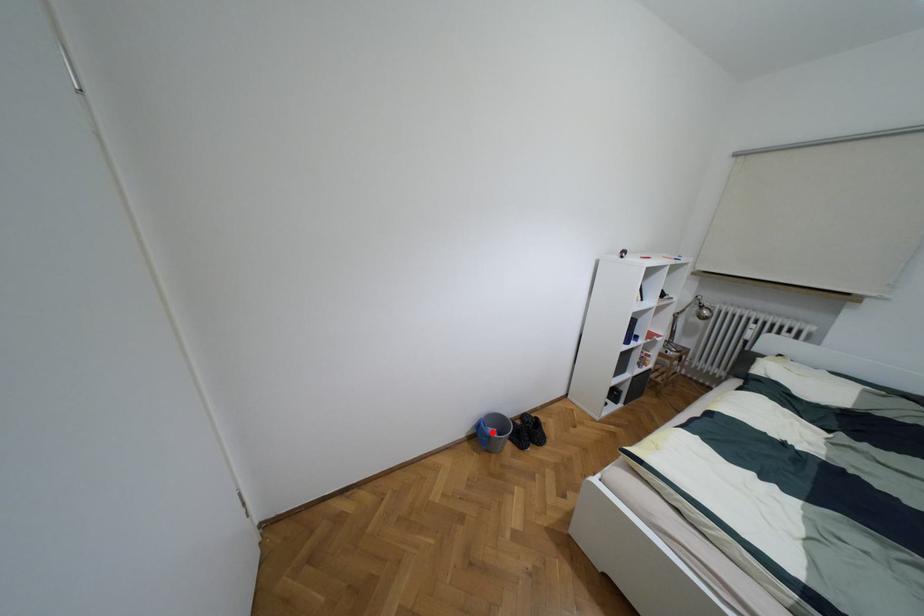
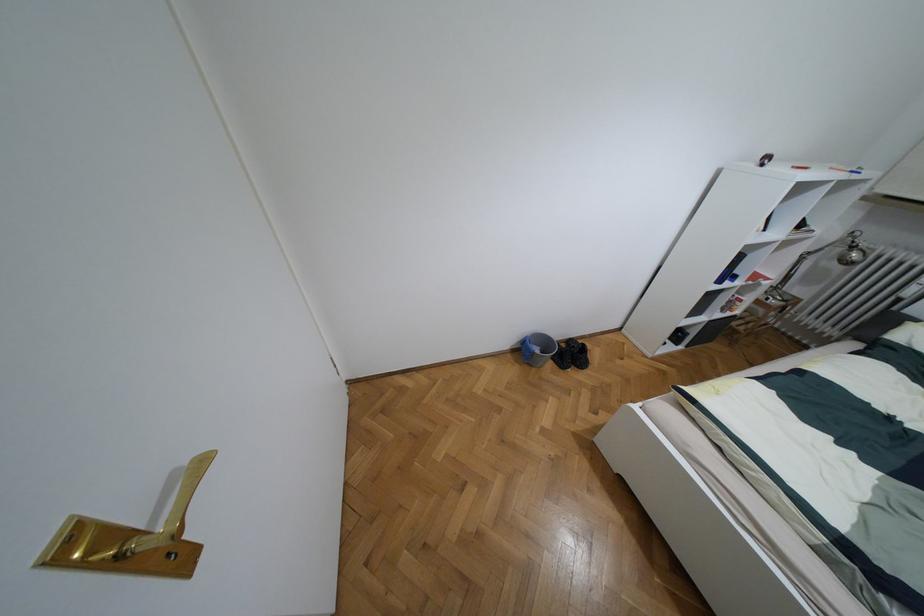
The point at the highlighted location is marked in the first image. Where is the corresponding point in the second image?

(536, 350)